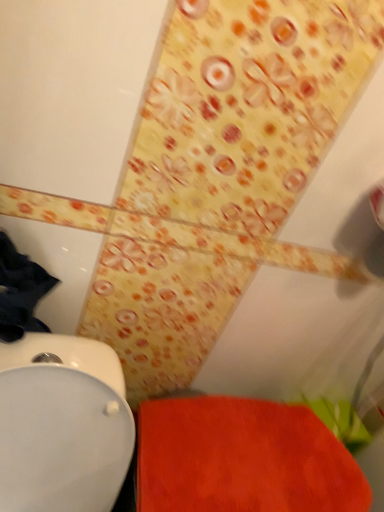
Question: Would you say orange fabric bath mat at lower right is inside or outside white glossy toilet at lower left?

Choices:
 (A) inside
 (B) outside

Answer: (B)

Question: In terms of size, does orange fabric bath mat at lower right appear bigger or smaller than white glossy toilet at lower left?

Choices:
 (A) big
 (B) small

Answer: (B)

Question: From a real-world perspective, relative to white glossy toilet at lower left, is orange fabric bath mat at lower right vertically above or below?

Choices:
 (A) below
 (B) above

Answer: (B)

Question: Is white glossy toilet at lower left to the left or to the right of orange fabric bath mat at lower right in the image?

Choices:
 (A) right
 (B) left

Answer: (B)

Question: Is white glossy toilet at lower left taller or shorter than orange fabric bath mat at lower right?

Choices:
 (A) short
 (B) tall

Answer: (B)

Question: Considering the positions of white glossy toilet at lower left and orange fabric bath mat at lower right in the image, is white glossy toilet at lower left bigger or smaller than orange fabric bath mat at lower right?

Choices:
 (A) big
 (B) small

Answer: (A)

Question: Is white glossy toilet at lower left wider or thinner than orange fabric bath mat at lower right?

Choices:
 (A) thin
 (B) wide

Answer: (B)